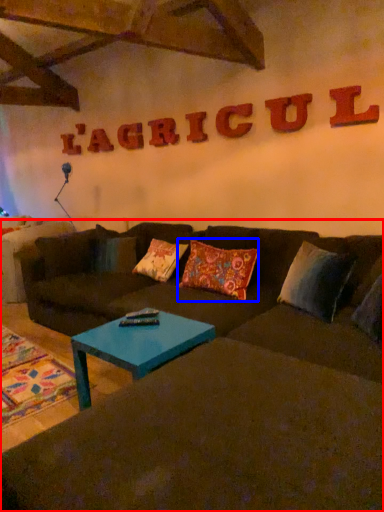
Question: Which object appears closest to the camera in this image, studio couch (highlighted by a red box) or pillow (highlighted by a blue box)?

Choices:
 (A) studio couch
 (B) pillow

Answer: (A)